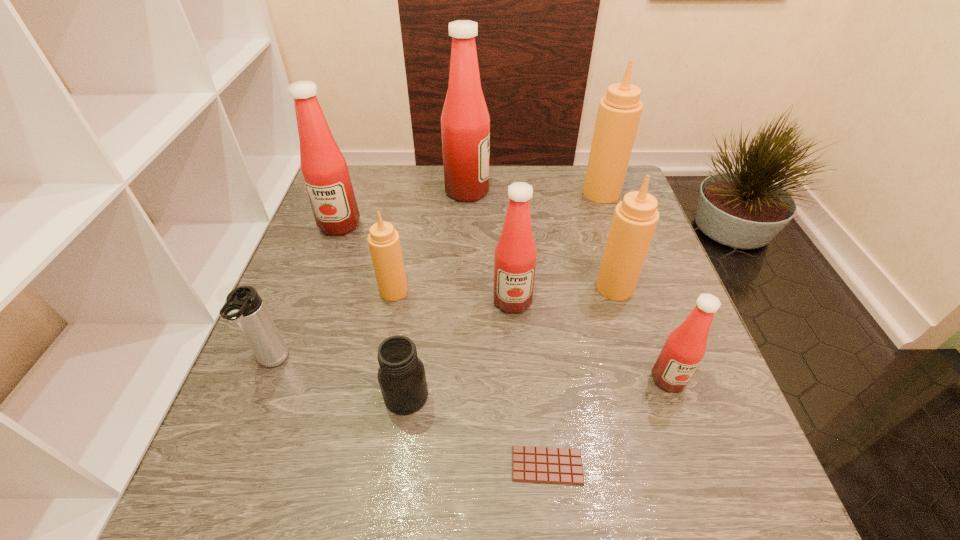
Find the location of a particular element. This screenshot has height=540, width=960. vacant area between the biggest red condiment and the second smallest tan condiment is located at coordinates [540, 239].

The image size is (960, 540). Identify the location of vacant space that's between the biggest tan condiment and the sixth condiment from right to left. (497, 242).

Identify the location of free space between the farthest tan condiment and the nearest object. The height and width of the screenshot is (540, 960). (574, 329).

The height and width of the screenshot is (540, 960). I want to click on free spot between the third farthest red condiment and the brown candy bar, so click(530, 383).

The height and width of the screenshot is (540, 960). Find the location of `empty location between the farthest red condiment and the sixth condiment from right to left`. empty location between the farthest red condiment and the sixth condiment from right to left is located at coordinates (430, 241).

What are the coordinates of `object that stands as the third closest to the third farthest condiment` in the screenshot? It's located at (244, 306).

Find the location of a particular element. object that can be found as the third closest to the third shortest object is located at coordinates (324, 169).

Locate an element on the screen. condiment that can be found as the fifth closest to the second biggest tan condiment is located at coordinates (384, 244).

Identify which condiment is the second nearest to the farthest red condiment. Please provide its 2D coordinates. Your answer should be formatted as a tuple, i.e. [(x, y)], where the tuple contains the x and y coordinates of a point satisfying the conditions above.

[(619, 111)]

Choose which red condiment is the third nearest neighbor to the smallest tan condiment. Please provide its 2D coordinates. Your answer should be formatted as a tuple, i.e. [(x, y)], where the tuple contains the x and y coordinates of a point satisfying the conditions above.

[(465, 122)]